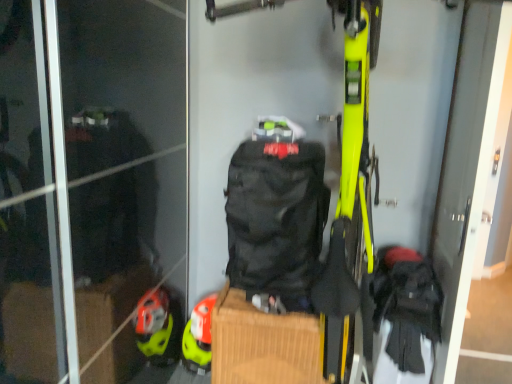
Question: From a real-world perspective, is matte yellow helmet at lower left beneath black fabric screen door at right?

Choices:
 (A) yes
 (B) no

Answer: (A)

Question: Considering the relative sizes of matte yellow helmet at lower left and black fabric screen door at right in the image provided, is matte yellow helmet at lower left thinner than black fabric screen door at right?

Choices:
 (A) yes
 (B) no

Answer: (B)

Question: From the image's perspective, is matte yellow helmet at lower left beneath black fabric screen door at right?

Choices:
 (A) yes
 (B) no

Answer: (A)

Question: Is matte yellow helmet at lower left oriented away from black fabric screen door at right?

Choices:
 (A) no
 (B) yes

Answer: (A)

Question: Are matte yellow helmet at lower left and black fabric screen door at right far apart?

Choices:
 (A) no
 (B) yes

Answer: (B)

Question: Considering the positions of black fabric screen door at right and matte yellow helmet at lower left in the image, is black fabric screen door at right bigger or smaller than matte yellow helmet at lower left?

Choices:
 (A) small
 (B) big

Answer: (B)

Question: From the image's perspective, is black fabric screen door at right positioned above or below matte yellow helmet at lower left?

Choices:
 (A) above
 (B) below

Answer: (A)

Question: Considering their positions, is black fabric screen door at right located in front of or behind matte yellow helmet at lower left?

Choices:
 (A) front
 (B) behind

Answer: (A)

Question: Is black fabric screen door at right taller or shorter than matte yellow helmet at lower left?

Choices:
 (A) tall
 (B) short

Answer: (A)

Question: Would you say matte yellow helmet at lower left is to the left or to the right of black fabric screen door at right in the picture?

Choices:
 (A) right
 (B) left

Answer: (B)

Question: Is point (207, 317) positioned closer to the camera than point (463, 312)?

Choices:
 (A) farther
 (B) closer

Answer: (A)

Question: From the image's perspective, is matte yellow helmet at lower left located above or below black fabric screen door at right?

Choices:
 (A) above
 (B) below

Answer: (B)

Question: In terms of size, does matte yellow helmet at lower left appear bigger or smaller than black fabric screen door at right?

Choices:
 (A) small
 (B) big

Answer: (A)

Question: In terms of size, does black fabric backpack at center appear bigger or smaller than black fabric screen door at right?

Choices:
 (A) big
 (B) small

Answer: (B)

Question: From a real-world perspective, relative to black fabric screen door at right, is black fabric backpack at center vertically above or below?

Choices:
 (A) above
 (B) below

Answer: (B)